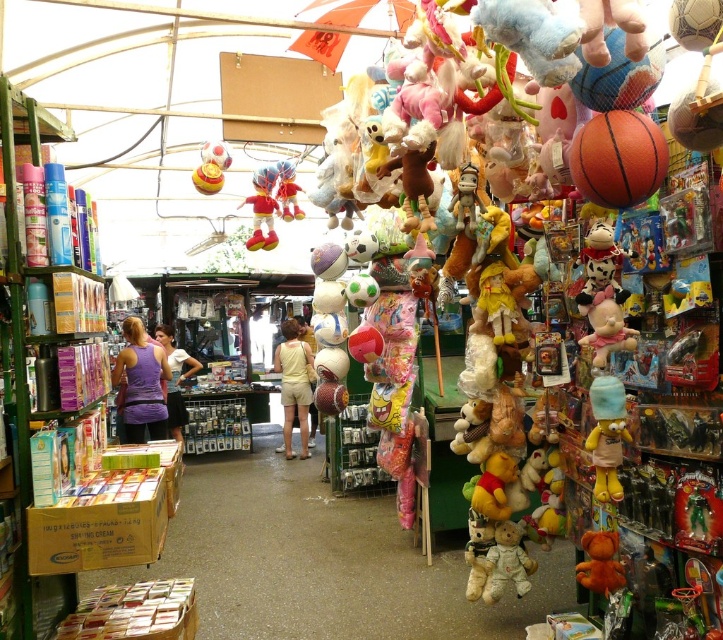
You are standing in the toy store and want to reach the exit, which is located at point (208, 154). There is an obstacle at point (502, 577). Can you walk directly to the exit without going around the obstacle?

Point (502, 577) is in front of point (208, 154), so the obstacle at point (502, 577) is blocking the path to the exit at point (208, 154). You will need to go around the obstacle to reach the exit.

You are a customer browsing the toy store and want to pick up both the yellow cotton shorts at center and the purple fabric shirt at center. Which item should you reach for first to grab the one closer to you?

The yellow cotton shorts at center is closer to you, so you should reach for it first before the purple fabric shirt at center.

You are a customer in the toy store and want to find both the yellow plush bear at right and the velvet plush toy at center. If you are standing in the middle of the store, which direction should you move to first to reach the closest toy?

The velvet plush toy at center is closer to your current position in the middle of the store, so you should move towards the center to reach it first.